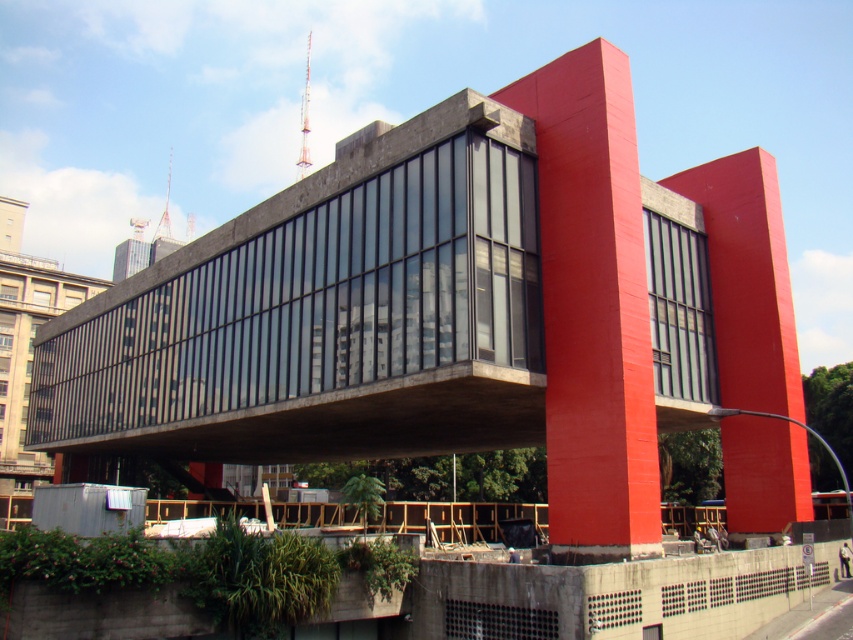
Question: Which object is farther from the camera taking this photo?

Choices:
 (A) smooth concrete pillar at center
 (B) matte concrete pillar at right

Answer: (B)

Question: Which object appears closest to the camera in this image?

Choices:
 (A) smooth concrete pillar at center
 (B) matte concrete pillar at right

Answer: (A)

Question: Which point appears closest to the camera in this image?

Choices:
 (A) (753, 173)
 (B) (521, 99)

Answer: (B)

Question: Is smooth concrete pillar at center thinner than matte concrete pillar at right?

Choices:
 (A) yes
 (B) no

Answer: (A)

Question: Does smooth concrete pillar at center have a smaller size compared to matte concrete pillar at right?

Choices:
 (A) no
 (B) yes

Answer: (A)

Question: Does smooth concrete pillar at center have a lesser width compared to matte concrete pillar at right?

Choices:
 (A) yes
 (B) no

Answer: (A)